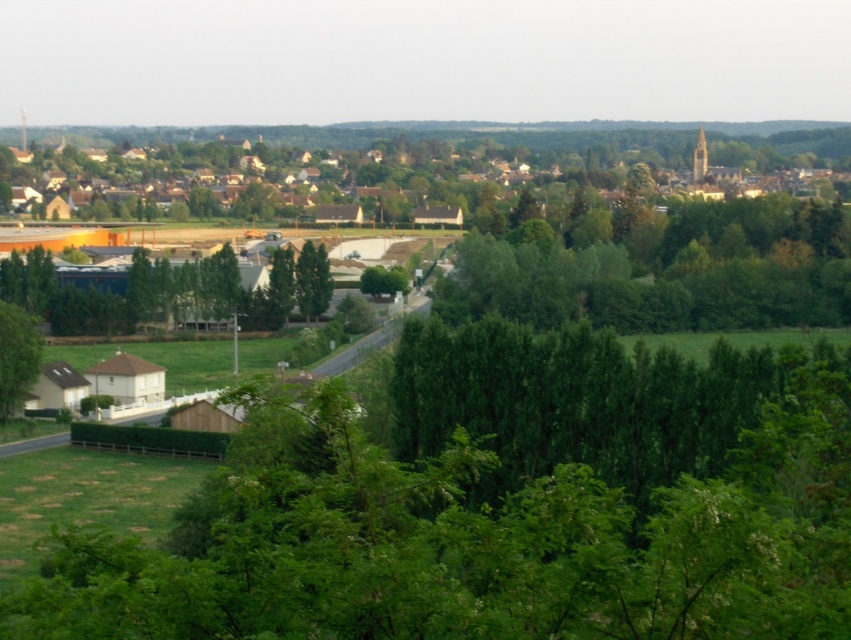
Question: Considering the relative positions of green leafy tree at lower center and green leafy tree at lower left in the image provided, where is green leafy tree at lower center located with respect to green leafy tree at lower left?

Choices:
 (A) above
 (B) below

Answer: (B)

Question: Which point is closer to the camera taking this photo?

Choices:
 (A) (551, 300)
 (B) (23, 365)
 (C) (307, 312)

Answer: (B)

Question: Considering the real-world distances, which object is farthest from the green leafy tree at center?

Choices:
 (A) green leafy trees at center
 (B) green leafy tree at lower left
 (C) green leafy tree at lower center

Answer: (C)

Question: Which point appears closest to the camera in this image?

Choices:
 (A) (847, 280)
 (B) (295, 140)

Answer: (A)

Question: Does green leafy trees at center have a lesser width compared to green leafy tree at lower left?

Choices:
 (A) no
 (B) yes

Answer: (A)

Question: Can you confirm if green leafy tree at lower center is positioned to the left of green leafy trees at center?

Choices:
 (A) no
 (B) yes

Answer: (B)